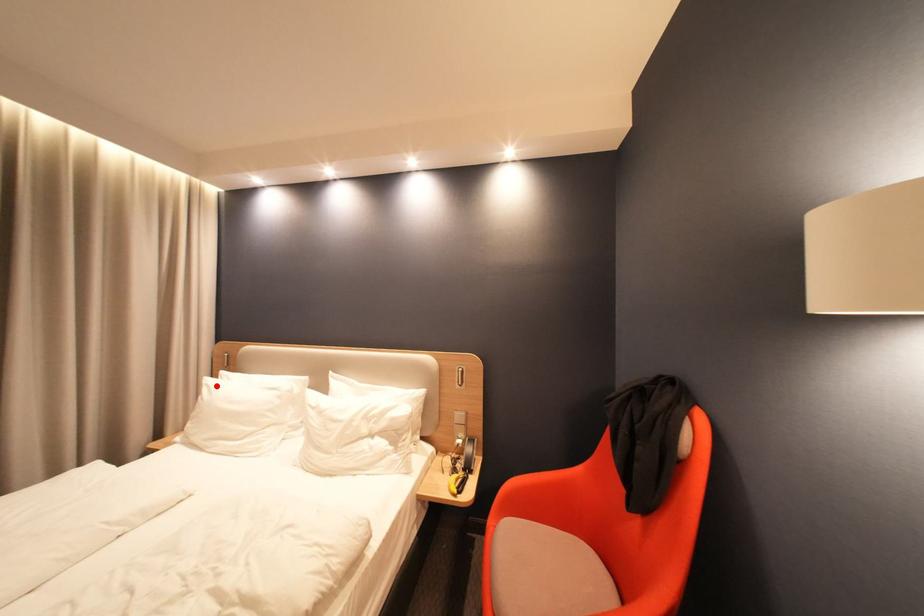
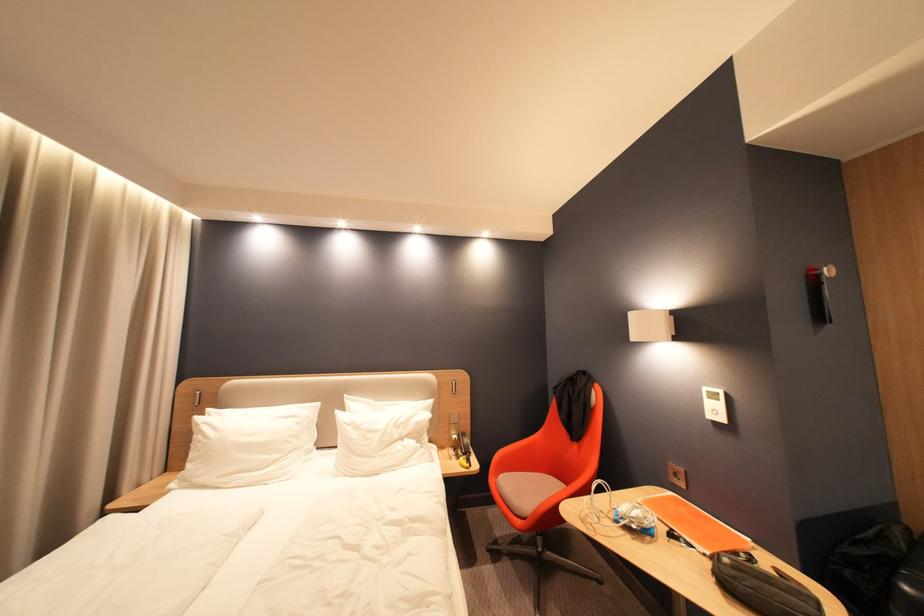
The point at the highlighted location is marked in the first image. Where is the corresponding point in the second image?

(213, 424)